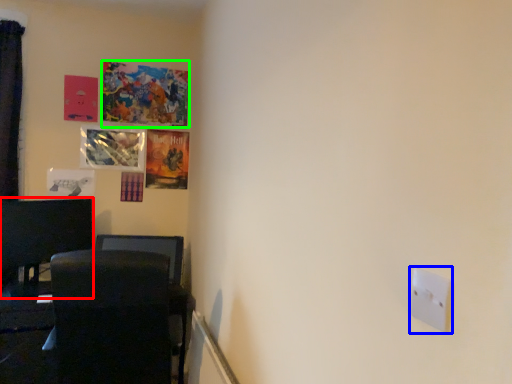
Question: Estimate the real-world distances between objects in this image. Which object is farther from furniture (highlighted by a red box), light switch (highlighted by a blue box) or picture frame (highlighted by a green box)?

Choices:
 (A) light switch
 (B) picture frame

Answer: (A)